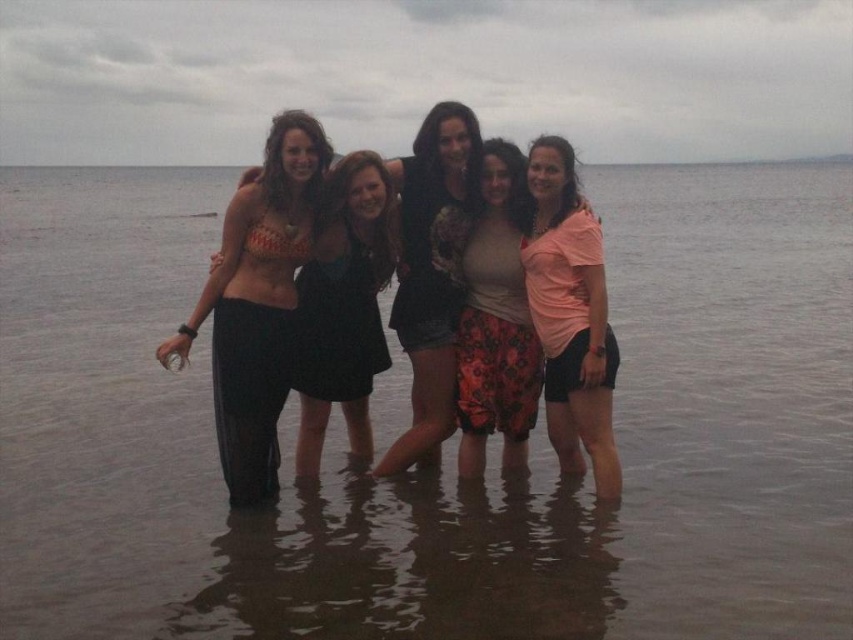
Question: Which point is farther to the camera?

Choices:
 (A) matte black bikini top at left
 (B) floral denim shorts at center
 (C) floral cotton shorts at center
 (D) matte bikini top at center

Answer: (B)

Question: Does clear water at center lie in front of matte black bikini top at left?

Choices:
 (A) yes
 (B) no

Answer: (A)

Question: Considering the relative positions of clear water at center and floral cotton shorts at center in the image provided, where is clear water at center located with respect to floral cotton shorts at center?

Choices:
 (A) left
 (B) right

Answer: (B)

Question: Which point appears farthest from the camera in this image?

Choices:
 (A) (445, 196)
 (B) (260, 294)
 (C) (845, 195)

Answer: (C)

Question: Estimate the real-world distances between objects in this image. Which object is farther from the matte black bikini top at left?

Choices:
 (A) matte bikini top at center
 (B) floral cotton shorts at center

Answer: (B)

Question: Is matte bikini top at center below floral denim shorts at center?

Choices:
 (A) yes
 (B) no

Answer: (B)